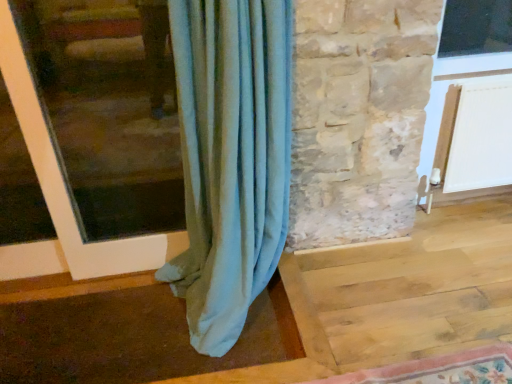
Question: Considering the positions of point click(407, 370) and point click(148, 74), is point click(407, 370) closer or farther from the camera than point click(148, 74)?

Choices:
 (A) closer
 (B) farther

Answer: (A)

Question: In the image, is rug with floral pattern at lower right on the left side or the right side of matte white window frame at left?

Choices:
 (A) right
 (B) left

Answer: (A)

Question: Which of these objects is positioned farthest from the white plastic screen door at upper right?

Choices:
 (A) matte white window frame at left
 (B) rug with floral pattern at lower right

Answer: (A)

Question: Estimate the real-world distances between objects in this image. Which object is farther from the matte white window frame at left?

Choices:
 (A) rug with floral pattern at lower right
 (B) white plastic screen door at upper right

Answer: (B)